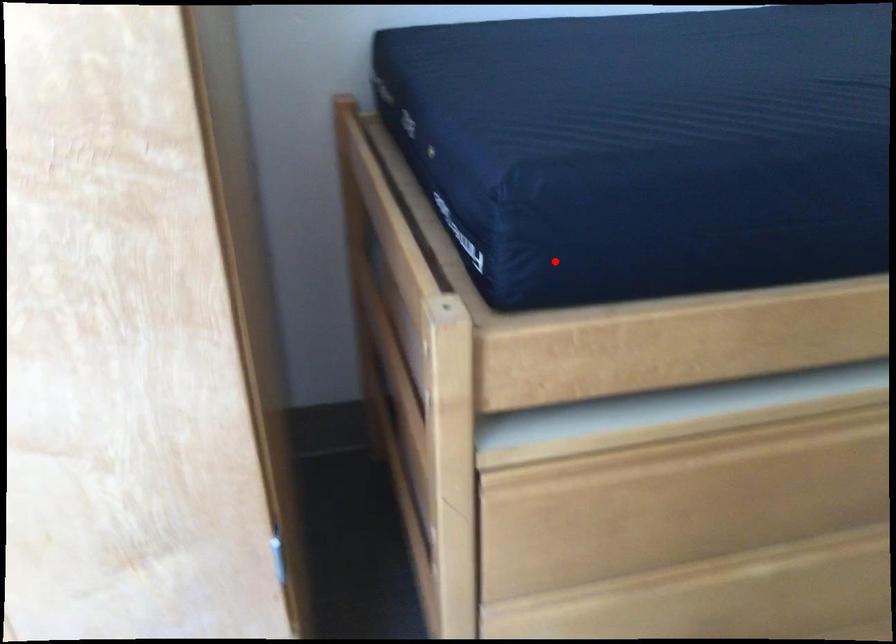
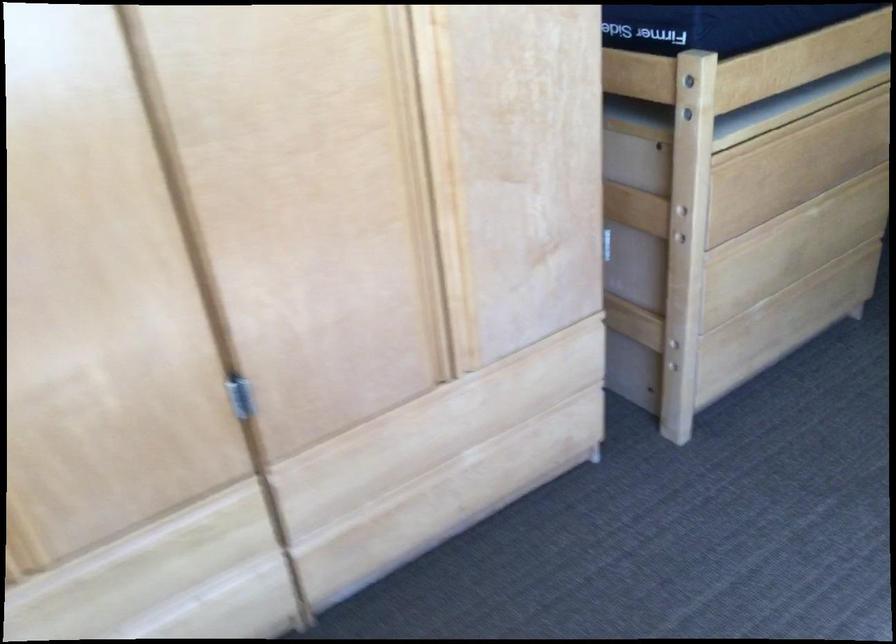
Question: A red point is marked in image1. In image2, is the corresponding 3D point closer to the camera or farther? Reply with the corresponding letter.

Choices:
 (A) The corresponding 3D point is closer.
 (B) The corresponding 3D point is farther.

Answer: (B)